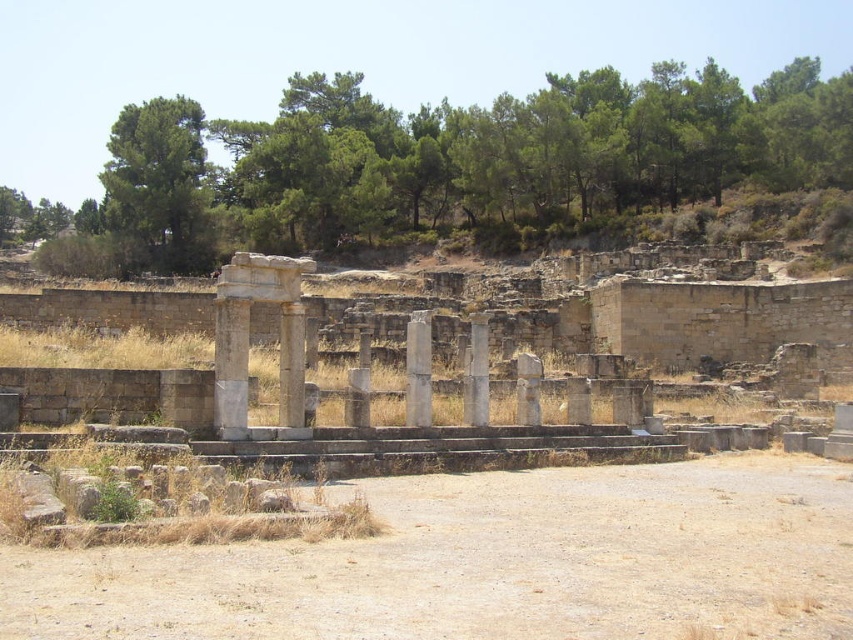
Who is more forward, (109, 140) or (415, 401)?

Positioned in front is point (415, 401).

What do you see at coordinates (445, 164) in the screenshot? I see `green leafy trees at upper center` at bounding box center [445, 164].

Where is `green leafy trees at upper center`? The image size is (853, 640). green leafy trees at upper center is located at coordinates (445, 164).

Does point (236, 340) come behind point (294, 307)?

No, it is in front of (294, 307).

Does white marble pillar at center have a greater width compared to white stone column at center?

No, white marble pillar at center is not wider than white stone column at center.

Find the location of a particular element. The height and width of the screenshot is (640, 853). white marble pillar at center is located at coordinates (231, 365).

Is point (152, 214) behind point (105, 196)?

No, it is in front of (105, 196).

Which is more to the left, green leafy trees at upper center or green leafy tree at upper left?

Positioned to the left is green leafy tree at upper left.

Is point (199, 227) less distant than point (154, 230)?

No, (199, 227) is further to viewer.

Where is `green leafy trees at upper center`? The width and height of the screenshot is (853, 640). green leafy trees at upper center is located at coordinates (445, 164).